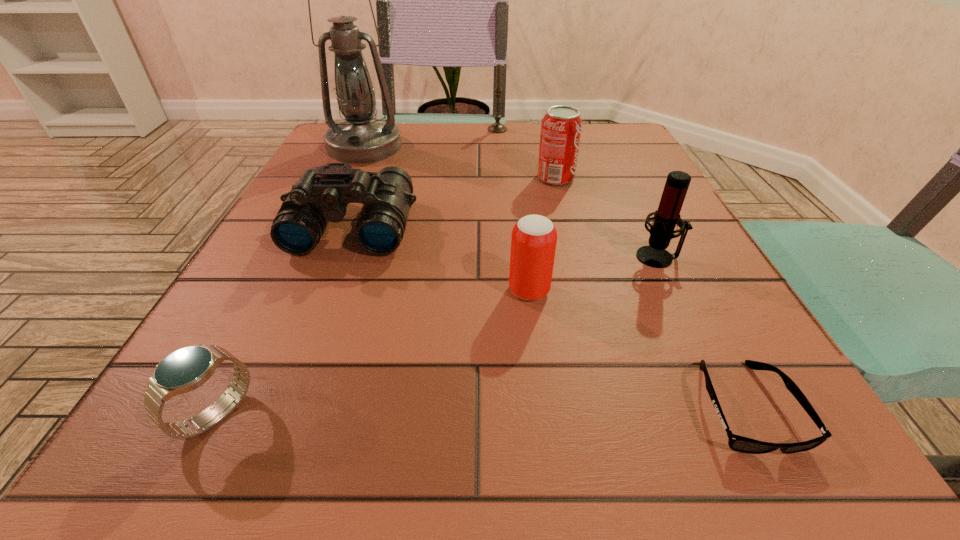
Identify the location of free space between the beer can and the binoculars. The width and height of the screenshot is (960, 540). (441, 259).

Identify which object is the fourth closest to the sixth object from left to right. Please provide its 2D coordinates. Your answer should be formatted as a tuple, i.e. [(x, y)], where the tuple contains the x and y coordinates of a point satisfying the conditions above.

[(534, 237)]

Choose which object is the nearest neighbor to the candle. Please provide its 2D coordinates. Your answer should be formatted as a tuple, i.e. [(x, y)], where the tuple contains the x and y coordinates of a point satisfying the conditions above.

[(561, 127)]

Identify the location of vacant region that satisfies the following two spatial constraints: 1. through the lenses of the binoculars; 2. on the right side of the microphone. Image resolution: width=960 pixels, height=540 pixels. (341, 257).

This screenshot has height=540, width=960. I want to click on free location that satisfies the following two spatial constraints: 1. through the lenses of the microphone; 2. on the left side of the binoculars, so click(x=341, y=257).

Where is `free space that satisfies the following two spatial constraints: 1. on the front side of the sixth object from left to right; 2. on the left side of the candle`? free space that satisfies the following two spatial constraints: 1. on the front side of the sixth object from left to right; 2. on the left side of the candle is located at coordinates (501, 178).